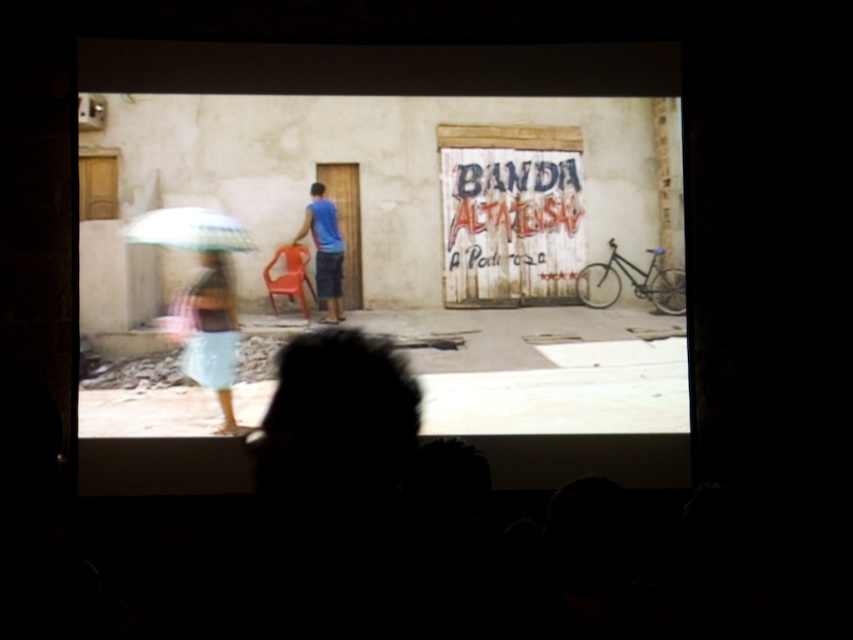
You are standing in front of the weathered wall with the banner. You need to locate the plaid fabric umbrella at left. Where exactly is it positioned relative to the banner?

The plaid fabric umbrella at left is positioned at coordinates point (212,332) relative to the banner.